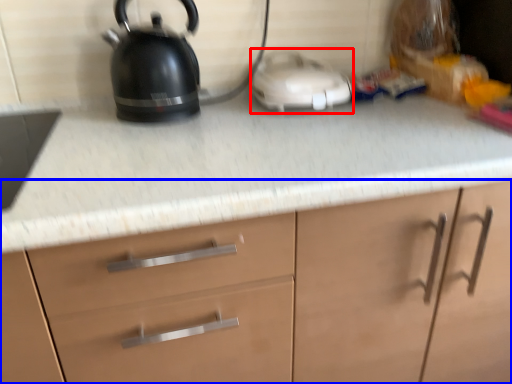
Question: Which point is closer to the camera, appliance (highlighted by a red box) or cabinetry (highlighted by a blue box)?

Choices:
 (A) appliance
 (B) cabinetry

Answer: (B)